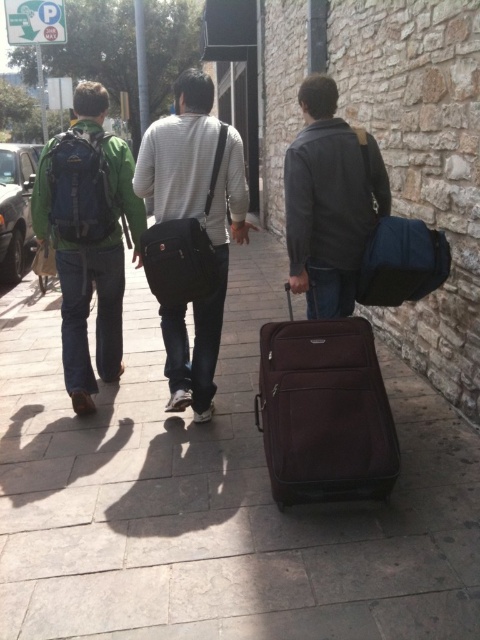
Can you confirm if dark brown fabric suitcase at center is positioned below matte black backpack at left?

Indeed, dark brown fabric suitcase at center is positioned under matte black backpack at left.

I want to click on dark brown fabric suitcase at center, so click(324, 412).

The height and width of the screenshot is (640, 480). Find the location of `dark brown fabric suitcase at center`. dark brown fabric suitcase at center is located at coordinates (324, 412).

The height and width of the screenshot is (640, 480). What do you see at coordinates (324, 412) in the screenshot?
I see `dark brown fabric suitcase at center` at bounding box center [324, 412].

Is point (351, 381) farther from camera compared to point (196, 104)?

No, (351, 381) is closer to viewer.

The image size is (480, 640). Find the location of `dark brown fabric suitcase at center`. dark brown fabric suitcase at center is located at coordinates (324, 412).

Identify the location of dark brown fabric suitcase at center. (324, 412).

Which of these two, matte black backpack at left or matte blue backpack at left, stands taller?

matte black backpack at left

Looking at this image, who is lower down, matte black backpack at left or matte blue backpack at left?

matte black backpack at left is below.

Identify the location of matte black backpack at left. Image resolution: width=480 pixels, height=640 pixels. (205, 298).

The width and height of the screenshot is (480, 640). What are the coordinates of `matte black backpack at left` in the screenshot? It's located at tap(205, 298).